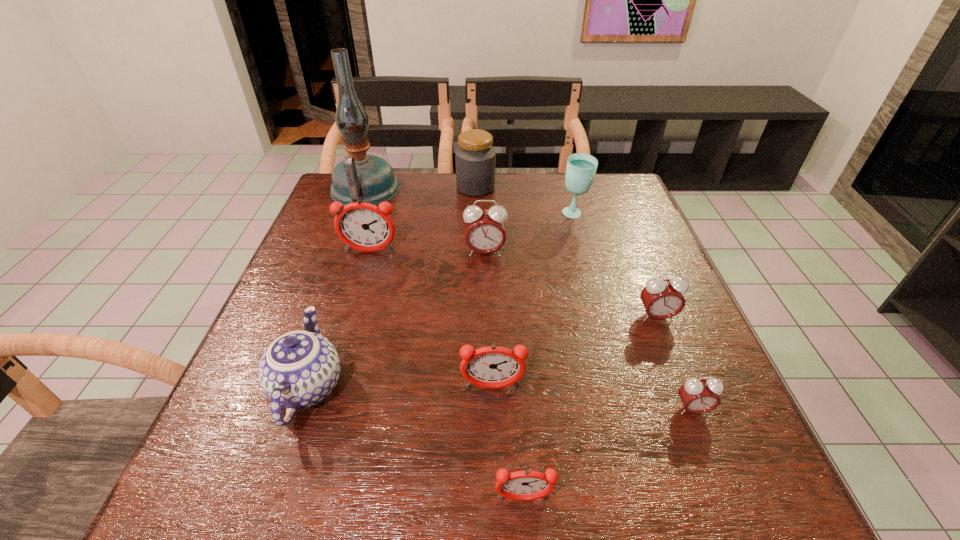
At what (x,y) coordinates should I click in order to perform the action: click on the second smallest reddish-pink alarm clock. Please return your answer as a coordinate pair (x, y). Looking at the image, I should click on click(x=493, y=367).

This screenshot has height=540, width=960. In order to click on the fourth farthest alarm clock in this screenshot , I will do `click(493, 367)`.

Image resolution: width=960 pixels, height=540 pixels. I want to click on the smallest pink alarm clock, so click(698, 396).

Identify the location of the fifth farthest alarm clock. (698, 396).

Identify the location of the smallest reddish-pink alarm clock. (526, 485).

At what (x,y) coordinates should I click in order to perform the action: click on the nearest reddish-pink alarm clock. Please return your answer as a coordinate pair (x, y). This screenshot has width=960, height=540. Looking at the image, I should click on (526, 485).

Where is `free space located on the right of the oil lamp`? The height and width of the screenshot is (540, 960). free space located on the right of the oil lamp is located at coordinates (416, 190).

The image size is (960, 540). I want to click on free space located 0.390m on the surface of the jar near the warning symbol, so click(624, 187).

Locate an element on the screen. The image size is (960, 540). vacant space located 0.120m on the back of the glass is located at coordinates (565, 185).

Find the location of a particular element. The width and height of the screenshot is (960, 540). vacant space positioned 0.150m on the clock face of the biggest pink alarm clock is located at coordinates (486, 302).